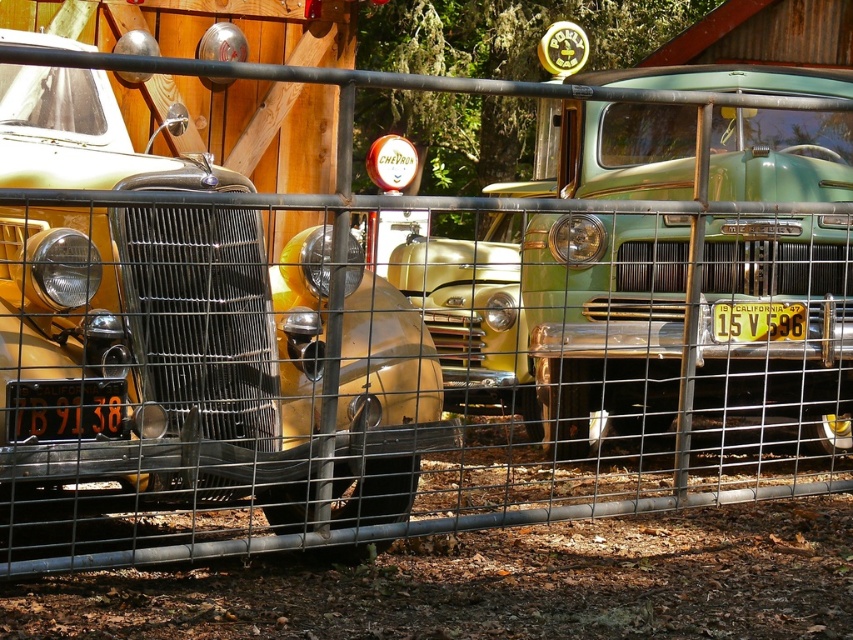
Question: Is black metal license plate at lower left closer to the viewer compared to yellow metal license plate at center?

Choices:
 (A) no
 (B) yes

Answer: (B)

Question: Is matte yellow car at left to the left of yellow metal license plate at center from the viewer's perspective?

Choices:
 (A) no
 (B) yes

Answer: (B)

Question: Which point appears farthest from the camera in this image?

Choices:
 (A) (782, 304)
 (B) (177, 160)
 (C) (97, 387)

Answer: (A)

Question: Which point is farther to the camera?

Choices:
 (A) black metal license plate at lower left
 (B) yellow metal license plate at center
 (C) matte yellow car at left

Answer: (B)

Question: Which of the following is the closest to the observer?

Choices:
 (A) (33, 436)
 (B) (364, 378)
 (C) (751, 339)

Answer: (A)

Question: Is matte yellow car at left above yellow metal license plate at center?

Choices:
 (A) yes
 (B) no

Answer: (A)